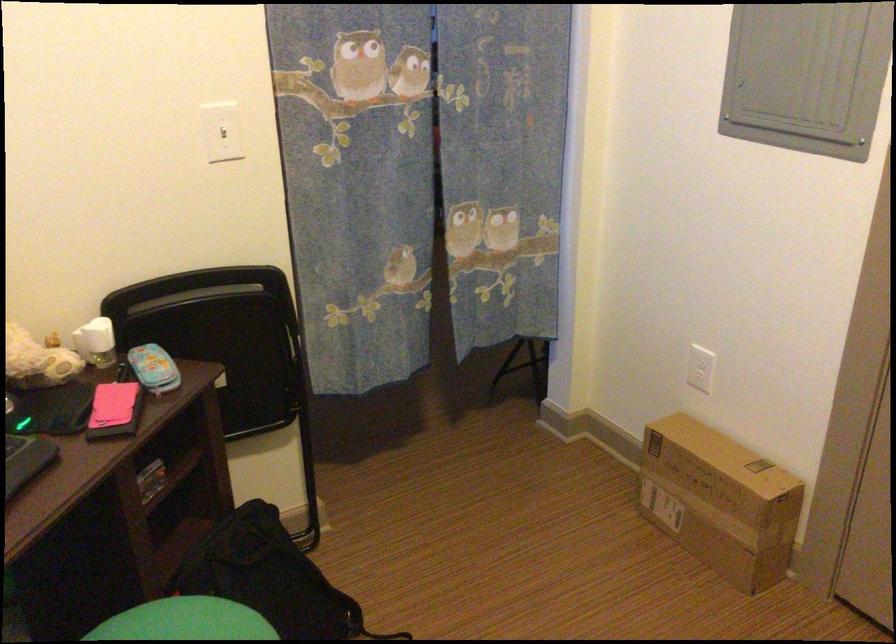
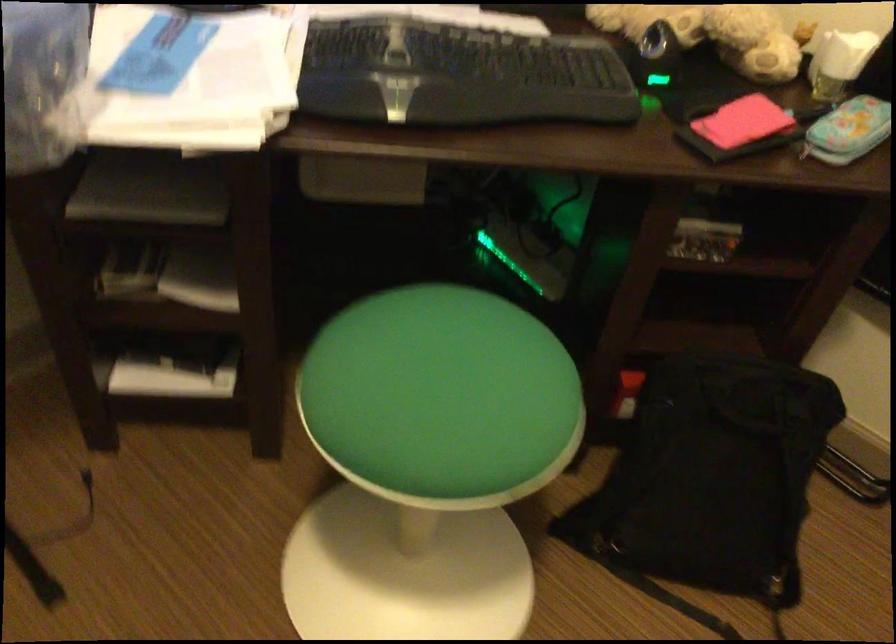
Based on the continuous images, in which direction is the camera rotating?

The camera rotated toward left-down.